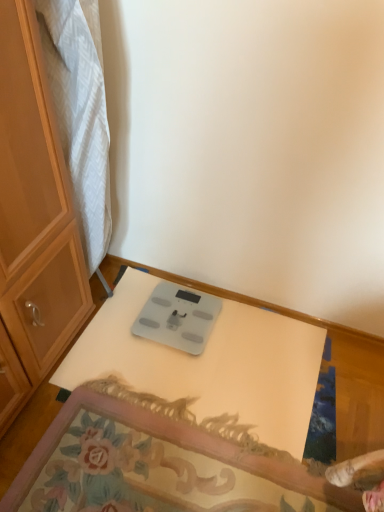
Question: Is white glossy table at center not near silver metallic scale at center?

Choices:
 (A) no
 (B) yes

Answer: (A)

Question: Is white glossy table at center facing towards silver metallic scale at center?

Choices:
 (A) no
 (B) yes

Answer: (B)

Question: Is white glossy table at center with silver metallic scale at center?

Choices:
 (A) no
 (B) yes

Answer: (A)

Question: Does white glossy table at center have a lesser height compared to silver metallic scale at center?

Choices:
 (A) yes
 (B) no

Answer: (B)

Question: Is white glossy table at center outside silver metallic scale at center?

Choices:
 (A) yes
 (B) no

Answer: (A)

Question: From a real-world perspective, is white glossy table at center located higher than silver metallic scale at center?

Choices:
 (A) yes
 (B) no

Answer: (A)

Question: Does white glossy table at center contain matte wood cabinet at left?

Choices:
 (A) yes
 (B) no

Answer: (B)

Question: Could you tell me if white glossy table at center is facing matte wood cabinet at left?

Choices:
 (A) yes
 (B) no

Answer: (B)

Question: Does white glossy table at center have a greater height compared to matte wood cabinet at left?

Choices:
 (A) no
 (B) yes

Answer: (A)

Question: Is white glossy table at center positioned far away from matte wood cabinet at left?

Choices:
 (A) no
 (B) yes

Answer: (A)

Question: Are white glossy table at center and matte wood cabinet at left beside each other?

Choices:
 (A) no
 (B) yes

Answer: (A)

Question: Is white glossy table at center to the right of matte wood cabinet at left from the viewer's perspective?

Choices:
 (A) yes
 (B) no

Answer: (A)

Question: From a real-world perspective, is silver metallic scale at center physically above white glossy table at center?

Choices:
 (A) no
 (B) yes

Answer: (A)